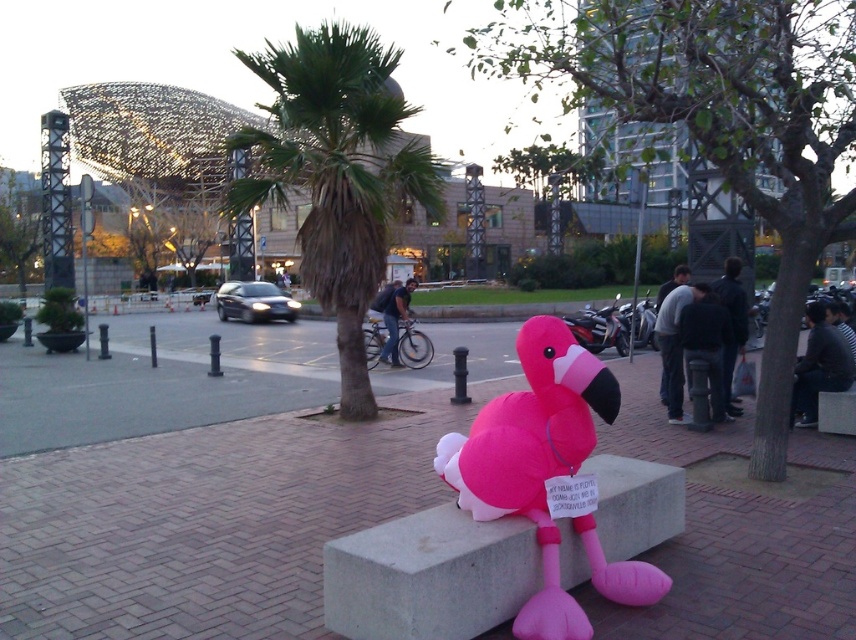
You are a city planner checking the placement of two pink flamingos in the urban park. The pink rubber flamingo at center and the pink inflatable flamingo at center are both on the same concrete bench. Which one is shorter?

The pink rubber flamingo at center is shorter than the pink inflatable flamingo at center.